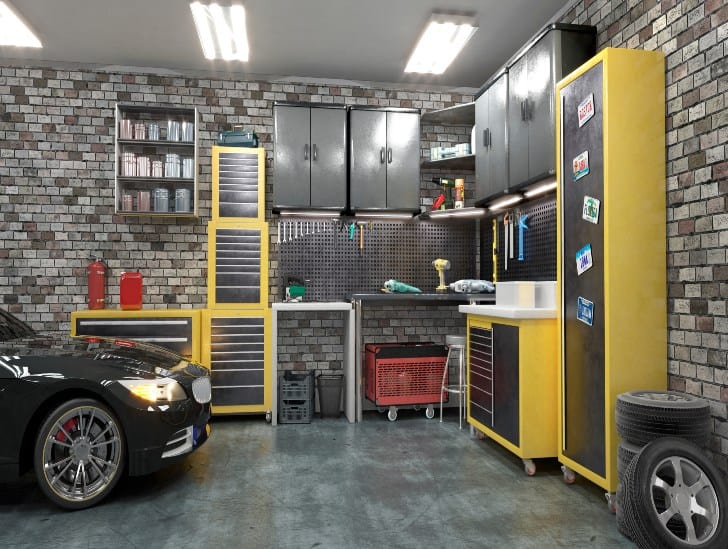
Where is `black upper cabinets`? The height and width of the screenshot is (549, 728). black upper cabinets is located at coordinates (304, 150), (391, 144), (486, 161), (538, 165).